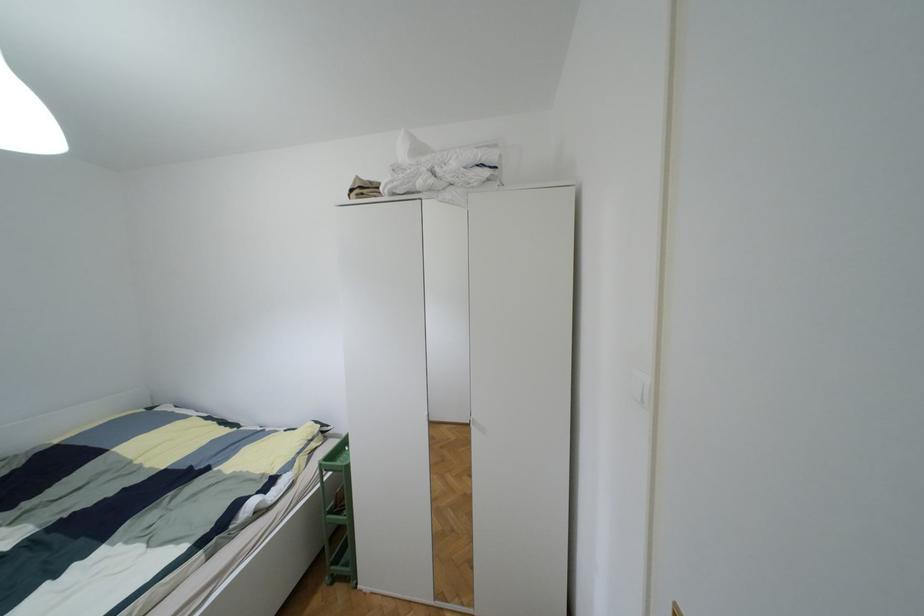
Find where to pull the green plastic cart. Please return your answer as a coordinate pair (x, y).

(337, 515)